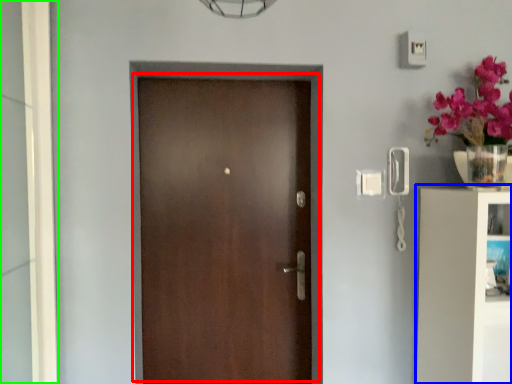
Question: Based on their relative distances, which object is nearer to door (highlighted by a red box)? Choose from bookshelf (highlighted by a blue box) and glass door (highlighted by a green box).

Choices:
 (A) bookshelf
 (B) glass door

Answer: (B)